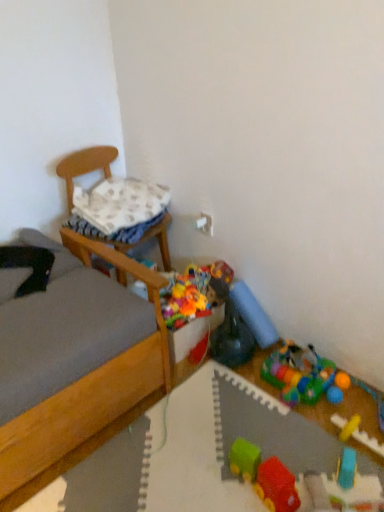
Locate an element on the screen. This screenshot has width=384, height=512. vacant space to the left of rubber duck at center, which is counted as the fifth toy, starting from the front is located at coordinates (196, 372).